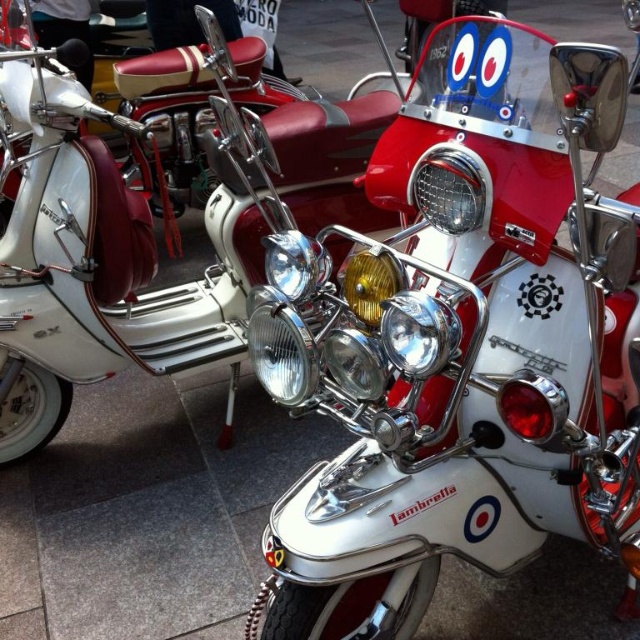
Question: Which object appears closest to the camera in this image?

Choices:
 (A) white chrome scooter at center
 (B) white chrome lambretta at center

Answer: (B)

Question: Can you confirm if white chrome lambretta at center is positioned to the right of white chrome scooter at center?

Choices:
 (A) yes
 (B) no

Answer: (A)

Question: Which point appears farthest from the camera in this image?

Choices:
 (A) (460, 353)
 (B) (45, 340)

Answer: (B)

Question: Observing the image, what is the correct spatial positioning of white chrome lambretta at center in reference to white chrome scooter at center?

Choices:
 (A) above
 (B) below

Answer: (B)

Question: Is white chrome lambretta at center positioned behind white chrome scooter at center?

Choices:
 (A) no
 (B) yes

Answer: (A)